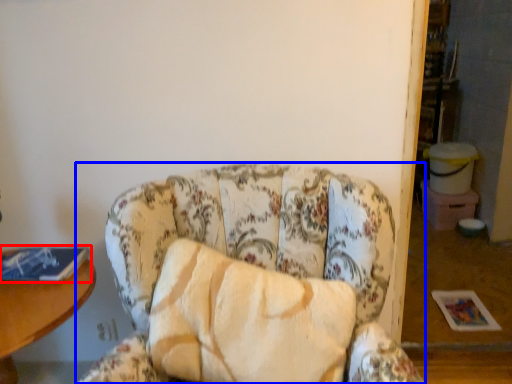
Question: Which object appears closest to the camera in this image, book (highlighted by a red box) or chair (highlighted by a blue box)?

Choices:
 (A) book
 (B) chair

Answer: (B)